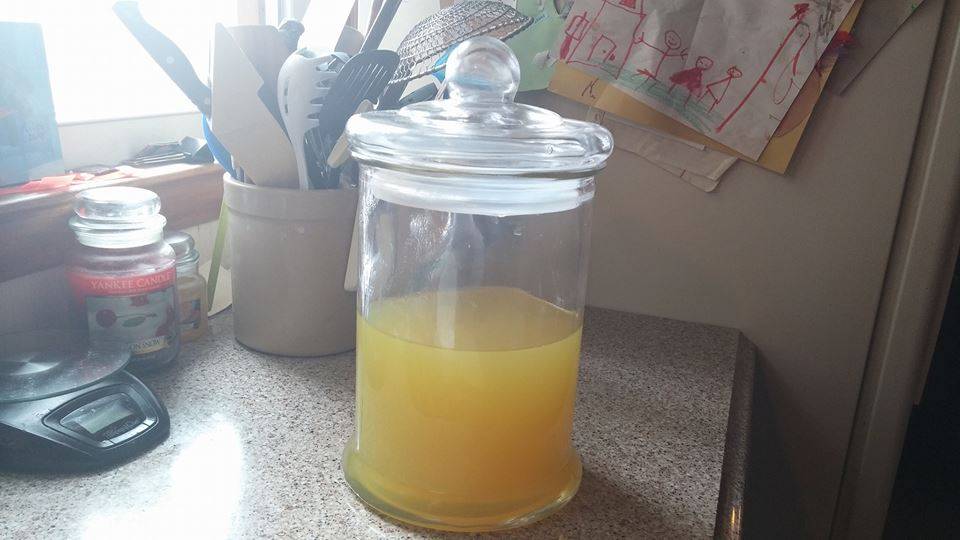
Locate an element on the screen. 1 container with utensils is located at coordinates (292, 87).